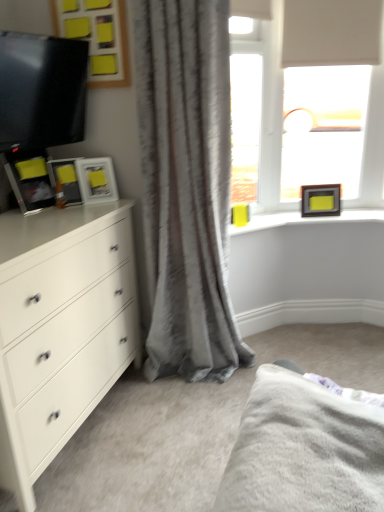
Question: Considering the relative sizes of white matte chest of drawers at left and gray textured curtain at center in the image provided, is white matte chest of drawers at left wider than gray textured curtain at center?

Choices:
 (A) no
 (B) yes

Answer: (B)

Question: Is white matte chest of drawers at left positioned before gray textured curtain at center?

Choices:
 (A) no
 (B) yes

Answer: (B)

Question: Is white matte chest of drawers at left with gray textured curtain at center?

Choices:
 (A) no
 (B) yes

Answer: (A)

Question: Considering the relative sizes of white matte chest of drawers at left and gray textured curtain at center in the image provided, is white matte chest of drawers at left taller than gray textured curtain at center?

Choices:
 (A) yes
 (B) no

Answer: (B)

Question: Is gray textured curtain at center a part of white matte chest of drawers at left?

Choices:
 (A) yes
 (B) no

Answer: (B)

Question: In terms of size, does matte black picture frame at left, which appears as the 2th picture frame when viewed from the back, appear bigger or smaller than white matte window at upper right?

Choices:
 (A) small
 (B) big

Answer: (A)

Question: Is point (104, 185) positioned closer to the camera than point (291, 206)?

Choices:
 (A) closer
 (B) farther

Answer: (A)

Question: Considering the positions of matte black picture frame at left, which appears as the 2th picture frame when viewed from the back, and white matte window at upper right in the image, is matte black picture frame at left, which appears as the 2th picture frame when viewed from the back, wider or thinner than white matte window at upper right?

Choices:
 (A) wide
 (B) thin

Answer: (A)

Question: Is matte black picture frame at left, which is the 2th picture frame from right to left, taller or shorter than white matte window at upper right?

Choices:
 (A) tall
 (B) short

Answer: (B)

Question: Based on their positions, is fuzzy gray bed at lower right located to the left or right of gray textured curtain at center?

Choices:
 (A) left
 (B) right

Answer: (B)

Question: Considering the positions of fuzzy gray bed at lower right and gray textured curtain at center in the image, is fuzzy gray bed at lower right bigger or smaller than gray textured curtain at center?

Choices:
 (A) small
 (B) big

Answer: (A)

Question: Does point (279, 444) appear closer or farther from the camera than point (162, 79)?

Choices:
 (A) farther
 (B) closer

Answer: (B)

Question: From the image's perspective, is fuzzy gray bed at lower right above or below gray textured curtain at center?

Choices:
 (A) above
 (B) below

Answer: (B)

Question: In terms of size, does matte black picture frame at left, which is the 2th picture frame from right to left, appear bigger or smaller than fuzzy gray bed at lower right?

Choices:
 (A) small
 (B) big

Answer: (A)

Question: Looking at their shapes, would you say matte black picture frame at left, which is the 2th picture frame from right to left, is wider or thinner than fuzzy gray bed at lower right?

Choices:
 (A) thin
 (B) wide

Answer: (A)